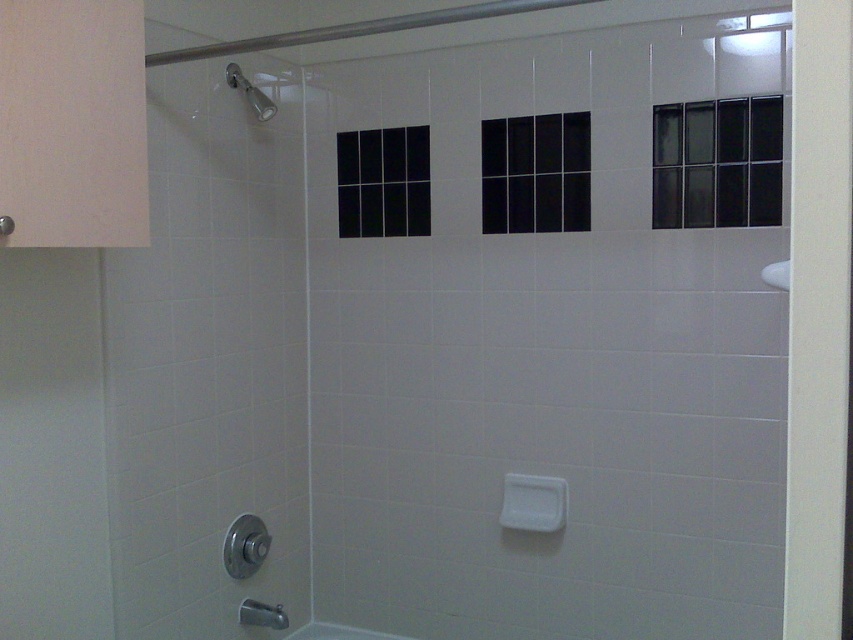
You are a plumber inspecting a bathroom. You see the black glass door at upper right and the white glossy sink at right. Which object is positioned higher on the wall?

The black glass door at upper right is located above the white glossy sink at right, so it is positioned higher on the wall.

Consider the image. You are standing in the bathroom and want to locate the black glass door at upper right. According to the scene description, where would you find it?

The black glass door at upper right is located at the upper right corner of the bathroom, near the top right area of the shower enclosure.